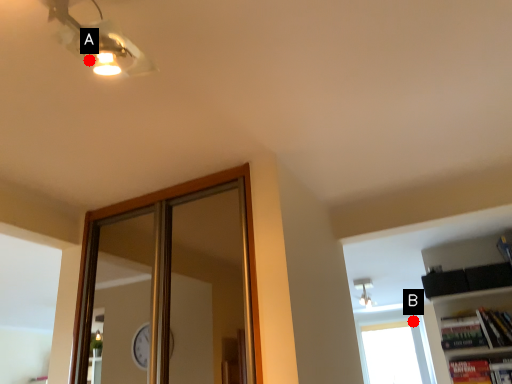
Question: Two points are circled on the image, labeled by A and B beside each circle. Among these points, which one is farthest from the camera?

Choices:
 (A) A is further
 (B) B is further

Answer: (B)